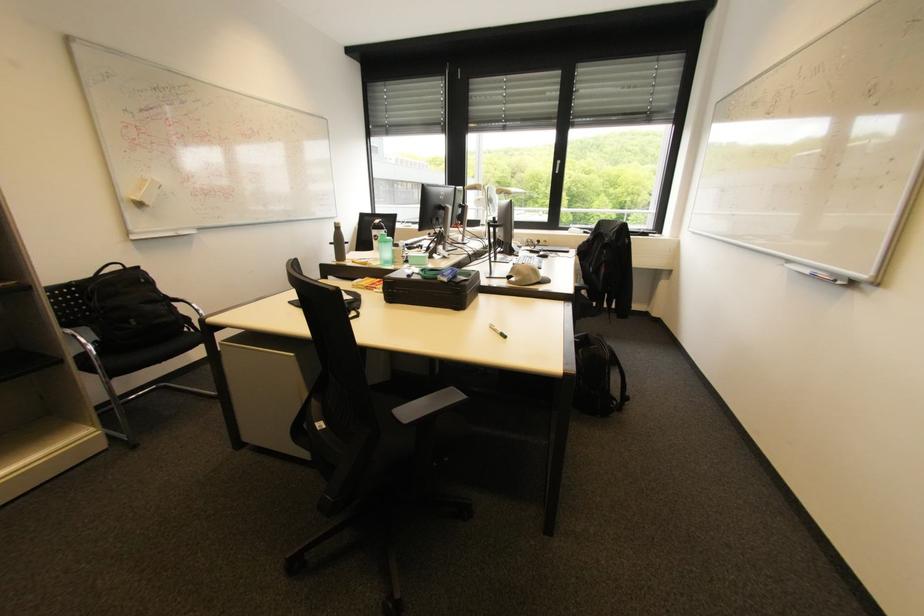
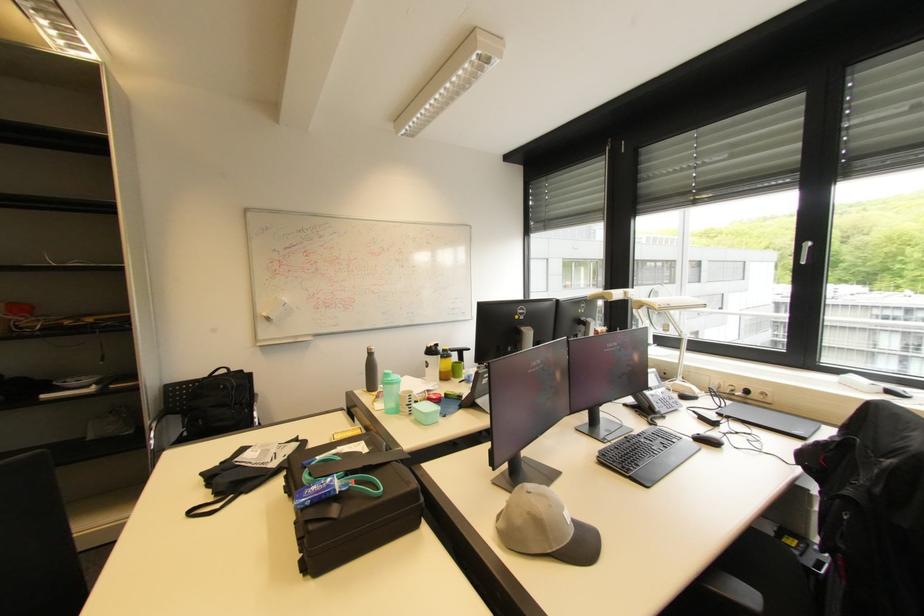
The point at (x=457, y=277) is marked in the first image. Where is the corresponding point in the second image?

(321, 501)